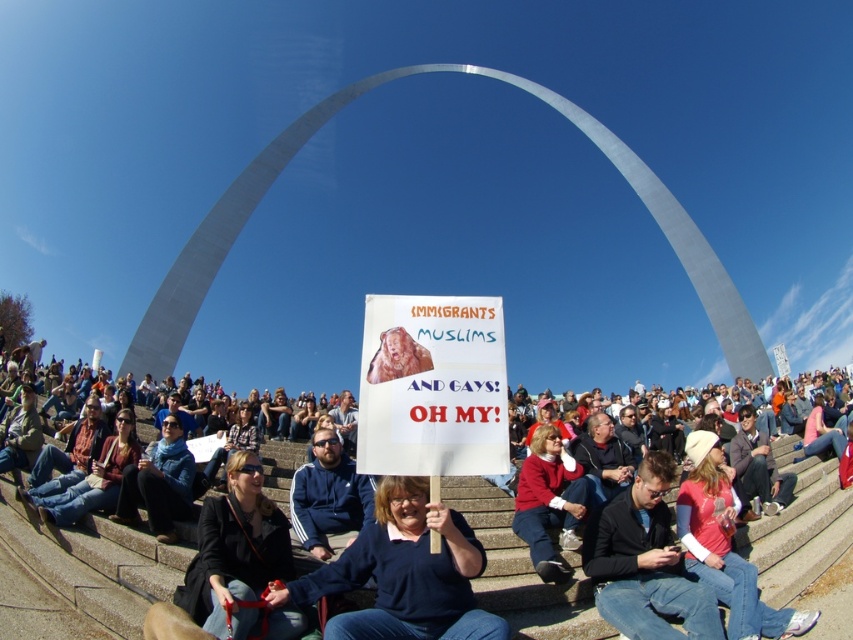
Question: Is blue sweater at center thinner than dark brown leather jacket at center?

Choices:
 (A) yes
 (B) no

Answer: (B)

Question: Which of the following is the farthest from the observer?

Choices:
 (A) (730, 522)
 (B) (672, 584)
 (C) (561, 476)
 (D) (810, 561)

Answer: (C)

Question: Among these points, which one is nearest to the camera?

Choices:
 (A) (537, 513)
 (B) (529, 564)

Answer: (B)

Question: Which object is positioned farthest from the dark brown leather jacket at center?

Choices:
 (A) red sweater at lower right
 (B) blue denim jeans at center
 (C) red sweater at center

Answer: (B)

Question: Is blue sweater at center positioned before red sweater at lower right?

Choices:
 (A) no
 (B) yes

Answer: (B)

Question: Is blue denim jeans at center wider than red sweater at lower right?

Choices:
 (A) yes
 (B) no

Answer: (A)